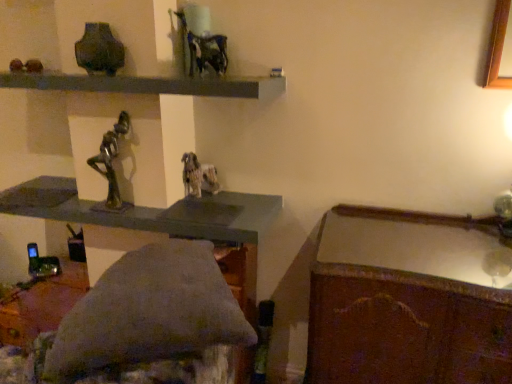
Question: Does wooden polished desk at lower right have a greater width compared to smooth gray shelf at upper center?

Choices:
 (A) no
 (B) yes

Answer: (B)

Question: Does wooden polished desk at lower right contain smooth gray shelf at upper center?

Choices:
 (A) no
 (B) yes

Answer: (A)

Question: Does wooden polished desk at lower right appear on the left side of smooth gray shelf at upper center?

Choices:
 (A) yes
 (B) no

Answer: (B)

Question: Is wooden polished desk at lower right next to smooth gray shelf at upper center?

Choices:
 (A) yes
 (B) no

Answer: (B)

Question: From the image's perspective, would you say wooden polished desk at lower right is shown under smooth gray shelf at upper center?

Choices:
 (A) yes
 (B) no

Answer: (A)

Question: Is wooden polished desk at lower right at the right side of smooth gray shelf at upper center?

Choices:
 (A) no
 (B) yes

Answer: (B)

Question: From the image's perspective, would you say smooth gray shelf at upper center is positioned over wooden polished desk at lower right?

Choices:
 (A) no
 (B) yes

Answer: (B)

Question: Can you confirm if smooth gray shelf at upper center is wider than wooden polished desk at lower right?

Choices:
 (A) yes
 (B) no

Answer: (B)

Question: Is smooth gray shelf at upper center bigger than wooden polished desk at lower right?

Choices:
 (A) no
 (B) yes

Answer: (A)

Question: Is wooden polished desk at lower right at the back of smooth gray shelf at upper center?

Choices:
 (A) no
 (B) yes

Answer: (A)

Question: Does smooth gray shelf at upper center have a greater height compared to wooden polished desk at lower right?

Choices:
 (A) no
 (B) yes

Answer: (A)

Question: Is smooth gray shelf at upper center completely or partially outside of wooden polished desk at lower right?

Choices:
 (A) no
 (B) yes

Answer: (B)

Question: Is smooth gray shelf at upper center outside of matte dark green vase at upper left?

Choices:
 (A) yes
 (B) no

Answer: (A)